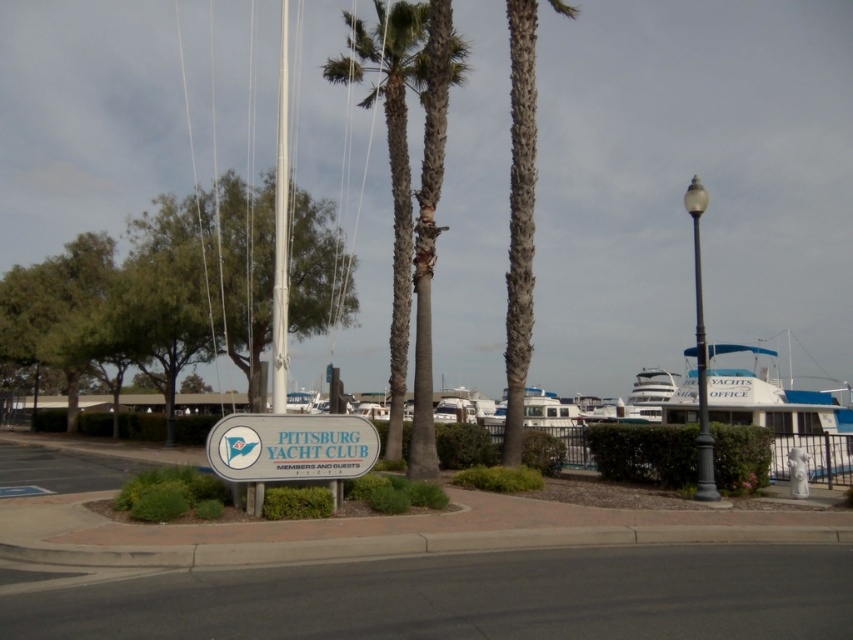
Based on the scene at the Pittsburg Yacht Club, where is the green textured palm tree at center located in terms of its 2D coordinates?

The green textured palm tree at center is located at the 2D coordinates point (409, 188).

You are standing at the center of the image and want to locate the green leafy tree at left. According to the coordinates provided, in which direction should you look to find it?

The green leafy tree at left is located at coordinates point (149, 292), so you should look to the left side of the image to find it.